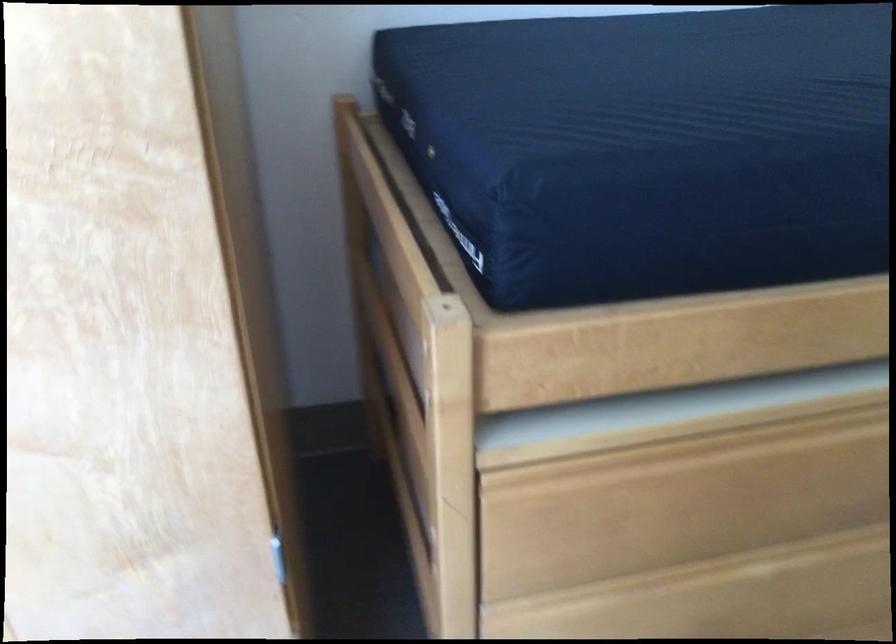
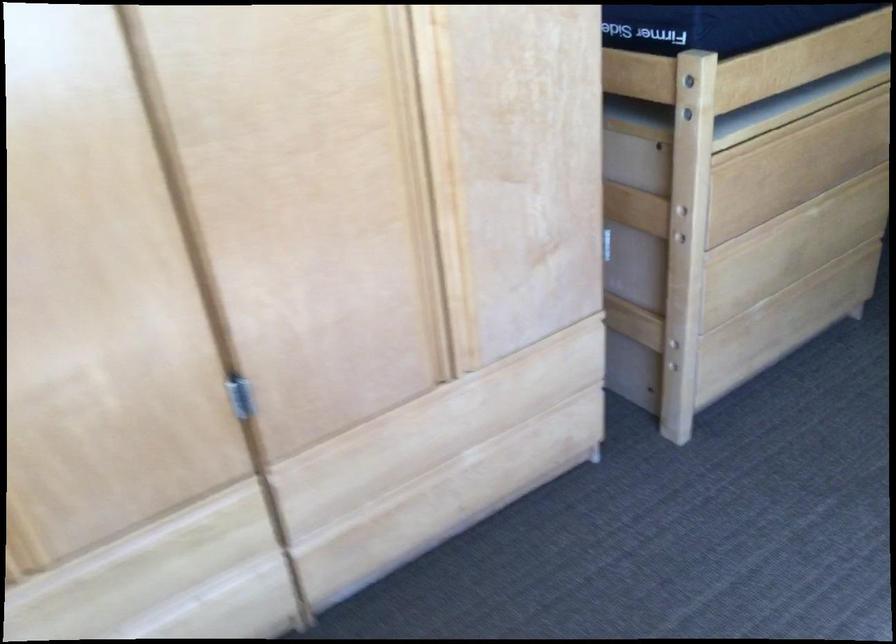
In the second image, find the point that corresponds to the point at 555,261 in the first image.

(718, 24)